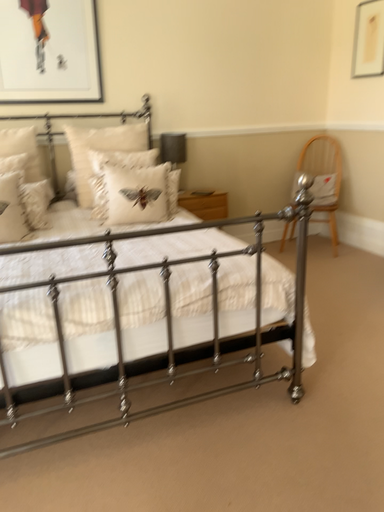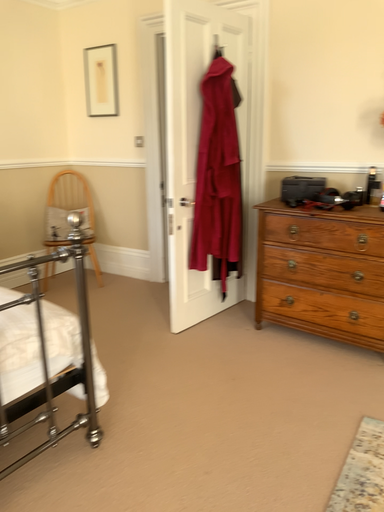
Question: How did the camera likely rotate when shooting the video?

Choices:
 (A) rotated left
 (B) rotated right

Answer: (B)